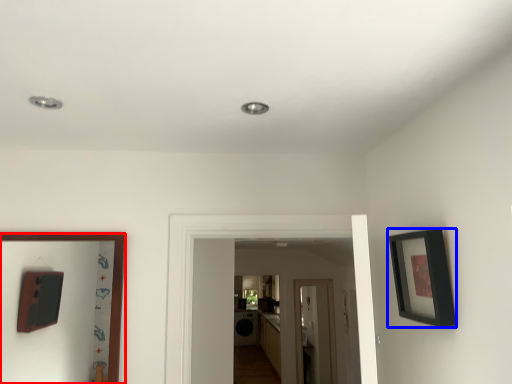
Question: Which of the following is the closest to the observer, picture frame (highlighted by a red box) or picture frame (highlighted by a blue box)?

Choices:
 (A) picture frame
 (B) picture frame

Answer: (B)